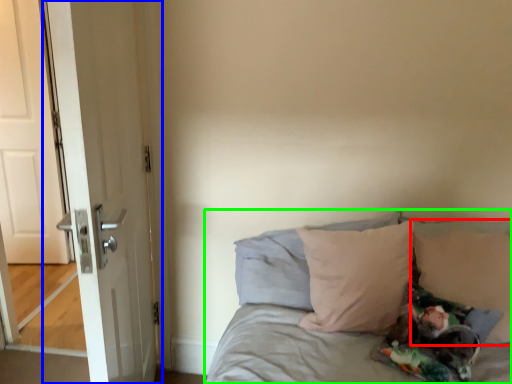
Question: Which object is positioned farthest from pillow (highlighted by a red box)? Select from door (highlighted by a blue box) and bed (highlighted by a green box).

Choices:
 (A) door
 (B) bed

Answer: (A)